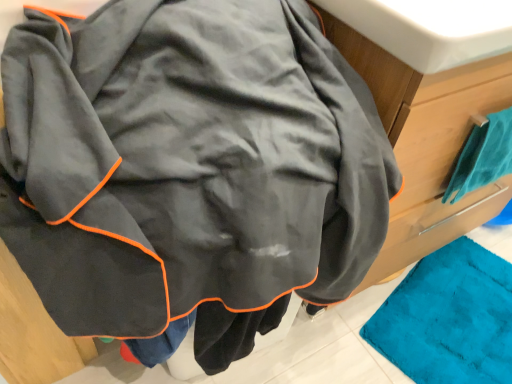
Question: Considering the relative positions of teal fabric towel at right and white glossy sink at upper center in the image provided, is teal fabric towel at right to the left or to the right of white glossy sink at upper center?

Choices:
 (A) right
 (B) left

Answer: (A)

Question: From a real-world perspective, is teal fabric towel at right above or below white glossy sink at upper center?

Choices:
 (A) below
 (B) above

Answer: (A)

Question: Considering the positions of point (506, 114) and point (418, 48), is point (506, 114) closer or farther from the camera than point (418, 48)?

Choices:
 (A) closer
 (B) farther

Answer: (B)

Question: From a real-world perspective, is white glossy sink at upper center physically located above or below teal fabric towel at right?

Choices:
 (A) above
 (B) below

Answer: (A)

Question: Would you say white glossy sink at upper center is to the left or to the right of teal fabric towel at right in the picture?

Choices:
 (A) right
 (B) left

Answer: (B)

Question: Looking at their shapes, would you say white glossy sink at upper center is wider or thinner than teal fabric towel at right?

Choices:
 (A) thin
 (B) wide

Answer: (B)

Question: Considering the positions of point pyautogui.click(x=385, y=11) and point pyautogui.click(x=478, y=173), is point pyautogui.click(x=385, y=11) closer or farther from the camera than point pyautogui.click(x=478, y=173)?

Choices:
 (A) closer
 (B) farther

Answer: (A)